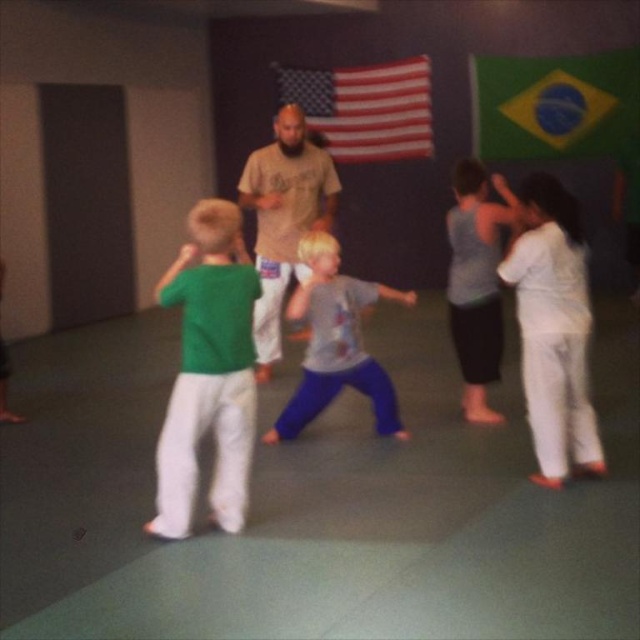
Is brown cotton shirt at center shorter than american flag at center?

Incorrect, brown cotton shirt at center's height does not fall short of american flag at center's.

What do you see at coordinates (284, 218) in the screenshot? This screenshot has height=640, width=640. I see `brown cotton shirt at center` at bounding box center [284, 218].

Identify the location of brown cotton shirt at center. This screenshot has width=640, height=640. (284, 218).

The height and width of the screenshot is (640, 640). What do you see at coordinates (284, 218) in the screenshot? I see `brown cotton shirt at center` at bounding box center [284, 218].

Is brown cotton shirt at center below gray cotton shirt at center?

Actually, brown cotton shirt at center is above gray cotton shirt at center.

Identify the location of brown cotton shirt at center. This screenshot has height=640, width=640. (284, 218).

Find the location of a particular element. The image size is (640, 640). brown cotton shirt at center is located at coordinates (284, 218).

Is green cotton shirt at left above gray cotton shirt at center?

Actually, green cotton shirt at left is below gray cotton shirt at center.

Is green cotton shirt at left taller than gray cotton shirt at center?

Yes.

Identify the location of green cotton shirt at left. The height and width of the screenshot is (640, 640). (209, 372).